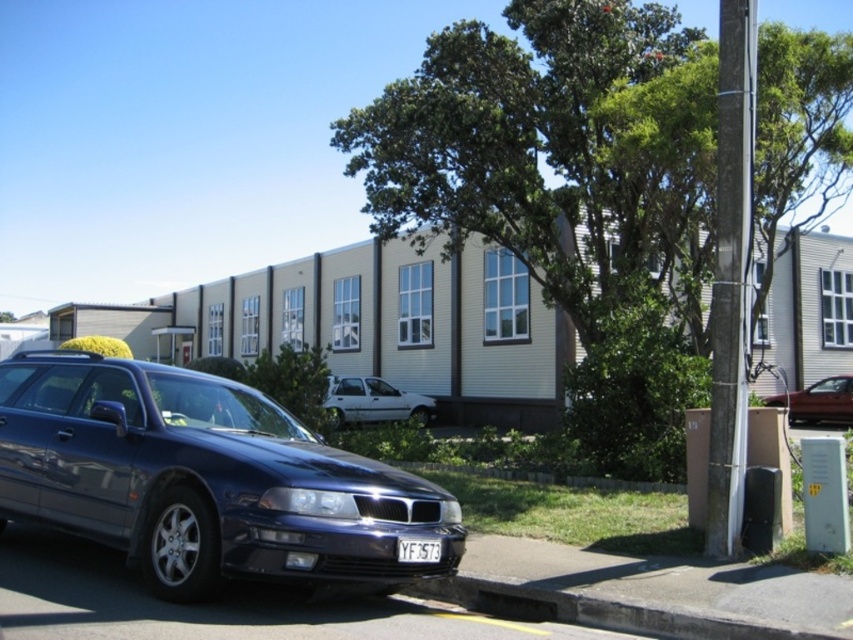
Question: Considering the relative positions of glossy metallic station wagon at lower left and shiny red car at right in the image provided, where is glossy metallic station wagon at lower left located with respect to shiny red car at right?

Choices:
 (A) below
 (B) above

Answer: (B)

Question: Can you confirm if white matte hatchback at center is positioned to the right of white plastic license plate at center?

Choices:
 (A) yes
 (B) no

Answer: (B)

Question: Is glossy metallic station wagon at lower left below shiny red car at right?

Choices:
 (A) no
 (B) yes

Answer: (A)

Question: Which object is farther from the camera taking this photo?

Choices:
 (A) black rubber curb at lower center
 (B) shiny red car at right
 (C) white plastic license plate at center
 (D) white matte hatchback at center

Answer: (B)

Question: Which point is farther to the camera?

Choices:
 (A) (795, 403)
 (B) (384, 385)
 (C) (199, 561)

Answer: (B)

Question: Which point is farther from the camera taking this photo?

Choices:
 (A) coord(343,388)
 (B) coord(405,214)
 (C) coord(450,595)

Answer: (A)